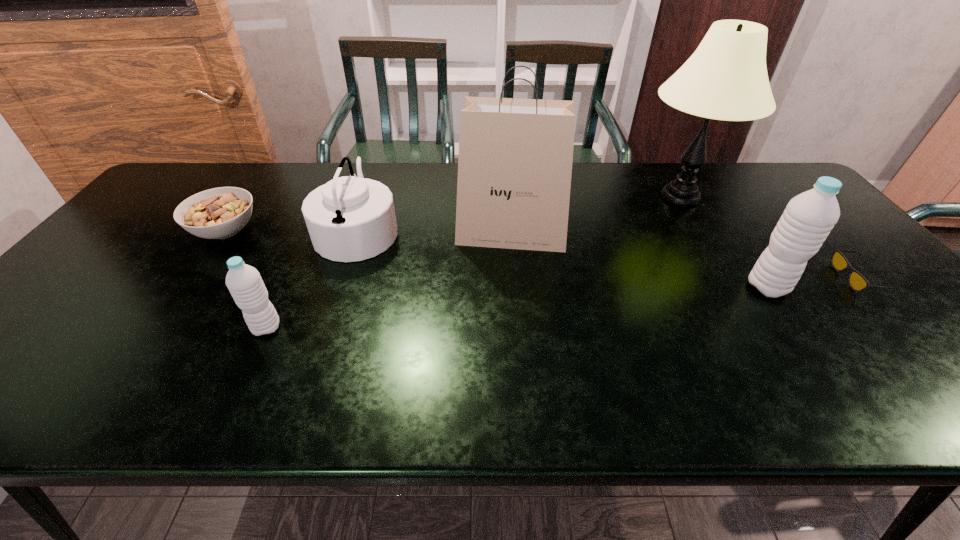
Where is `the shortest object`? The image size is (960, 540). the shortest object is located at coordinates (857, 282).

The image size is (960, 540). Find the location of `vacant region located on the left of the left water bottle`. vacant region located on the left of the left water bottle is located at coordinates (97, 328).

Locate an element on the screen. The height and width of the screenshot is (540, 960). vacant space located on the left of the fifth shortest object is located at coordinates (638, 287).

Locate an element on the screen. vacant space situated on the left of the lamp is located at coordinates (573, 198).

Where is `free space located 0.340m on the right of the stew`? free space located 0.340m on the right of the stew is located at coordinates (379, 232).

Identify the location of vacant space located 0.130m on the back of the shopping bag. (508, 193).

Where is `free space located on the spout of the kettle`? free space located on the spout of the kettle is located at coordinates (496, 230).

Where is `free space located 0.220m on the front-facing side of the rightmost object`? free space located 0.220m on the front-facing side of the rightmost object is located at coordinates (756, 279).

This screenshot has width=960, height=540. Find the location of `free space located 0.360m on the front-facing side of the rightmost object`. free space located 0.360m on the front-facing side of the rightmost object is located at coordinates (700, 279).

This screenshot has width=960, height=540. Find the location of `free point located 0.170m on the front-facing side of the rightmost object`. free point located 0.170m on the front-facing side of the rightmost object is located at coordinates (775, 279).